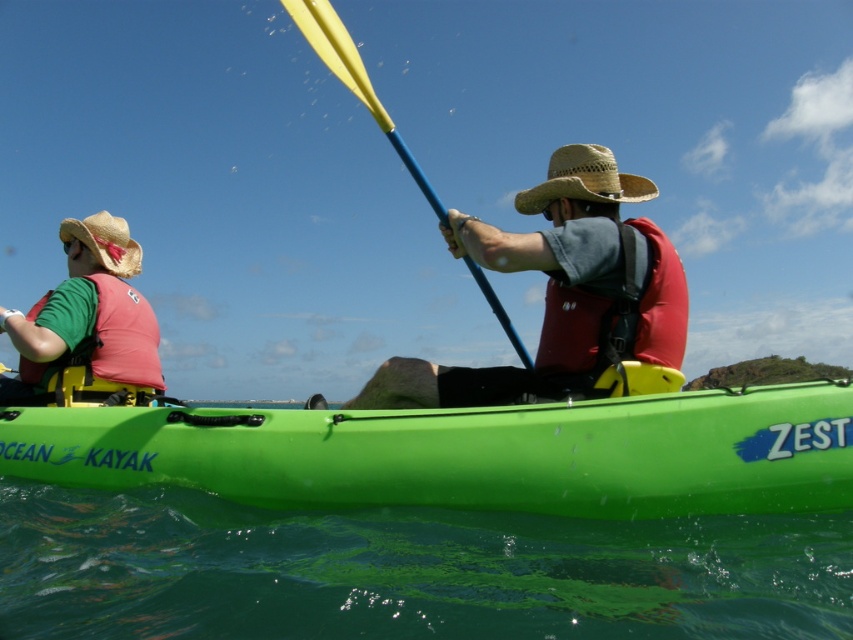
You are a photographer trying to capture the kayakers. You want to frame the yellowsmoothpaddle at center and the straw hat at left in your shot. Based on their positions, which object should you place closer to the left edge of your camera frame?

The straw hat at left should be placed closer to the left edge of the camera frame since it is positioned to the left of the yellowsmoothpaddle at center.

Looking at this image, you are planning to store the green plastic kayak at center and the matte red life vest at center in a storage unit. The storage unit has a width limit of 1 meter. Given that the kayak is wider than the life vest, can both items be placed side by side within the storage unit?

The green plastic kayak at center is wider than the matte red life vest at center. Since the storage unit has a width limit of 1 meter and the kayak alone exceeds the life vest in width, placing them side by side may exceed the storage unit width limit. However, without exact measurements, it is uncertain. The description only states the kayak is wider, not by how much.

You are planning to store the green plastic kayak at center and the matte red life vest at center in a storage room. The storage room has a height limit of 1.2 meters. Can both items be stored vertically without exceeding the height limit?

The green plastic kayak at center has a larger size compared to matte red life vest at center. However, the exact height of both items is not provided. Therefore, it is uncertain if they can be stored vertically without exceeding the height limit of 1.2 meters.